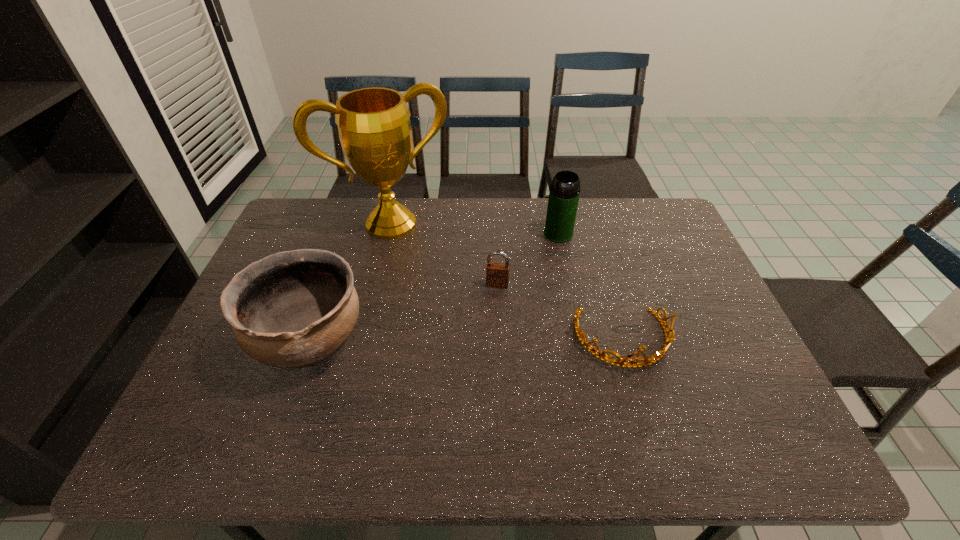
Find the location of a particular element. This screenshot has height=540, width=960. pottery that is at the left edge is located at coordinates (293, 309).

Identify the location of award at the left edge. (374, 127).

You are a GUI agent. You are given a task and a screenshot of the screen. Output one action in this format:
    pyautogui.click(x=<x>, y=<y>)
    Task: Click on the object that is at the far left corner
    
    Given the screenshot: What is the action you would take?
    pyautogui.click(x=374, y=127)

I want to click on object at the near left corner, so click(x=293, y=309).

Locate an element on the screen. The image size is (960, 540). vacant space at the far edge is located at coordinates (514, 210).

At what (x,y) coordinates should I click in order to perform the action: click on vacant space at the near edge of the desktop. Please return your answer as a coordinate pair (x, y). Looking at the image, I should click on (267, 400).

Identify the location of vacant space at the right edge. This screenshot has width=960, height=540. (690, 342).

Locate an element on the screen. The image size is (960, 540). vacant point at the near right corner is located at coordinates (732, 406).

This screenshot has width=960, height=540. I want to click on free point between the fourth tallest object and the tallest object, so click(x=444, y=254).

You are a GUI agent. You are given a task and a screenshot of the screen. Output one action in this format:
    pyautogui.click(x=<x>, y=<y>)
    Task: Click on the unoccupied position between the thermos bottle and the tiara
    The image size is (960, 540).
    Given the screenshot: What is the action you would take?
    pyautogui.click(x=590, y=287)